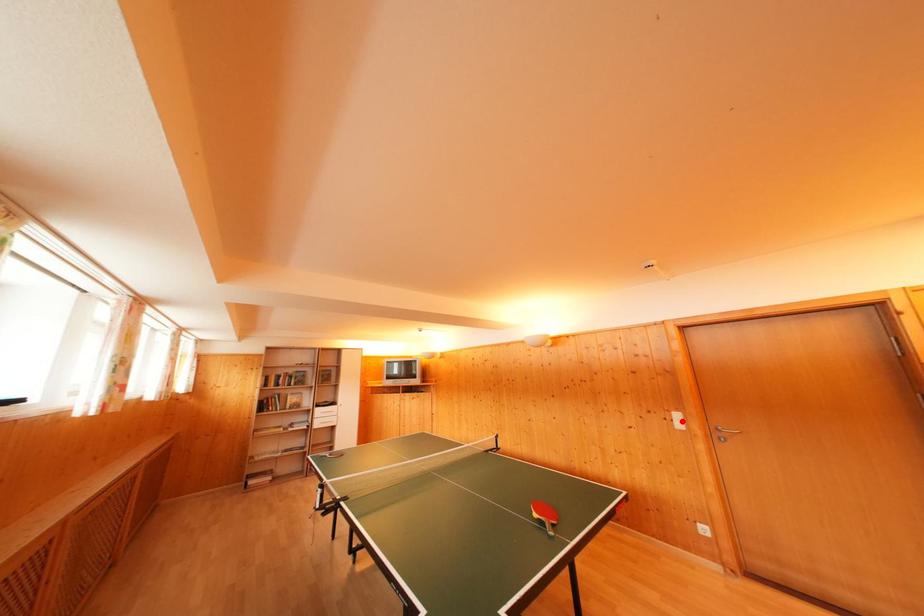
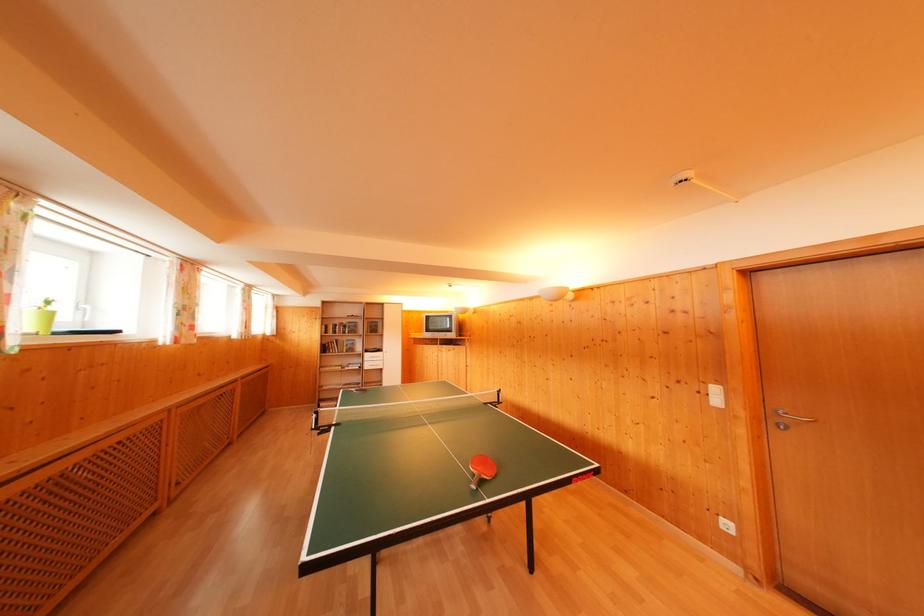
Locate, in the second image, the point that corresponds to the highlighted location in the first image.

(721, 395)